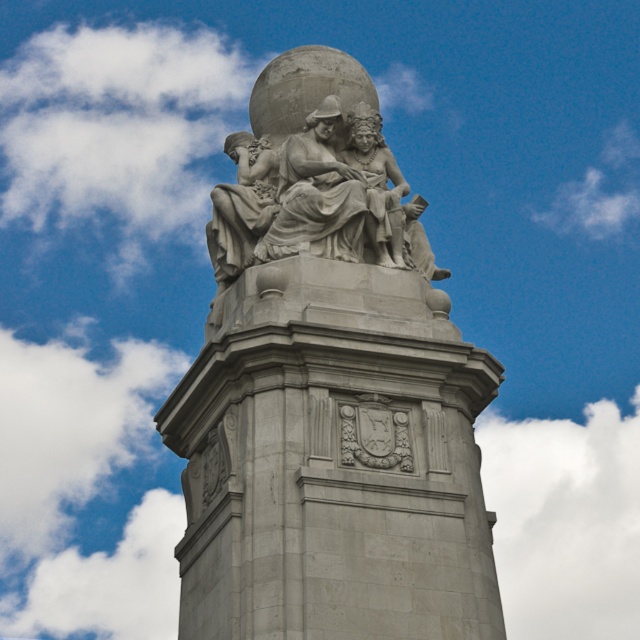
Looking at this image, between gray stone statue at center and white fluffy cloud at upper right, which one has more height?

gray stone statue at center

Is gray stone statue at center shorter than white fluffy cloud at upper right?

Incorrect, gray stone statue at center's height does not fall short of white fluffy cloud at upper right's.

Image resolution: width=640 pixels, height=640 pixels. I want to click on gray stone statue at center, so click(328, 390).

Where is `gray stone statue at center`? This screenshot has height=640, width=640. gray stone statue at center is located at coordinates (328, 390).

Does gray stone statue at center have a lesser width compared to white fluffy cloud at upper left?

Correct, gray stone statue at center's width is less than white fluffy cloud at upper left's.

How distant is gray stone statue at center from white fluffy cloud at upper left?

gray stone statue at center and white fluffy cloud at upper left are 62.69 meters apart.

The width and height of the screenshot is (640, 640). Identify the location of gray stone statue at center. (328, 390).

Between white fluffy cloud at upper right and white fluffy cloud at upper left, which one appears on the right side from the viewer's perspective?

From the viewer's perspective, white fluffy cloud at upper right appears more on the right side.

Between point (621, 438) and point (145, 412), which one is positioned in front?

Point (145, 412) is more forward.

Locate an element on the screen. This screenshot has width=640, height=640. white fluffy cloud at upper right is located at coordinates (564, 520).